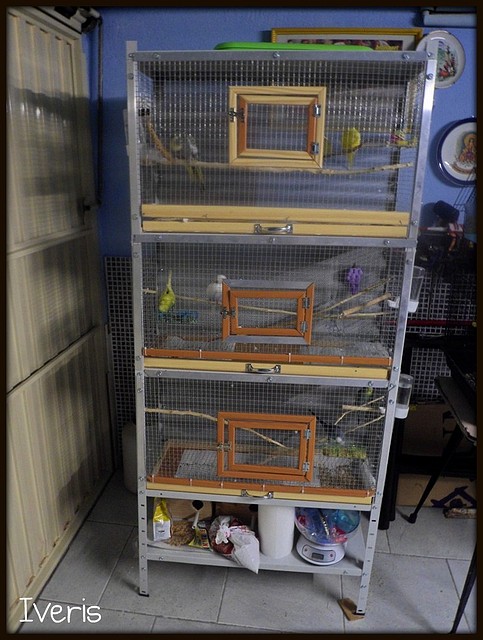
The width and height of the screenshot is (483, 640). I want to click on top of painting, so tap(394, 36).